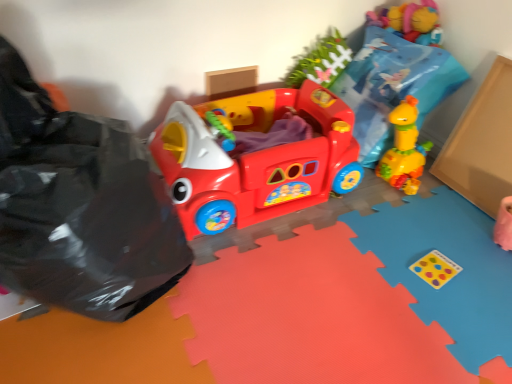
Question: From the image's perspective, is matte plastic play car at center positioned above or below black plastic bag at left?

Choices:
 (A) below
 (B) above

Answer: (B)

Question: Choose the correct answer: Is matte plastic play car at center inside black plastic bag at left or outside it?

Choices:
 (A) inside
 (B) outside

Answer: (B)

Question: Looking at their shapes, would you say matte plastic play car at center is wider or thinner than black plastic bag at left?

Choices:
 (A) wide
 (B) thin

Answer: (A)

Question: Is black plastic bag at left bigger or smaller than matte plastic play car at center?

Choices:
 (A) big
 (B) small

Answer: (A)

Question: Is point (45, 127) closer or farther from the camera than point (195, 231)?

Choices:
 (A) farther
 (B) closer

Answer: (B)

Question: Considering their positions, is black plastic bag at left located in front of or behind matte plastic play car at center?

Choices:
 (A) front
 (B) behind

Answer: (A)

Question: From a real-world perspective, is black plastic bag at left physically located above or below matte plastic play car at center?

Choices:
 (A) above
 (B) below

Answer: (A)